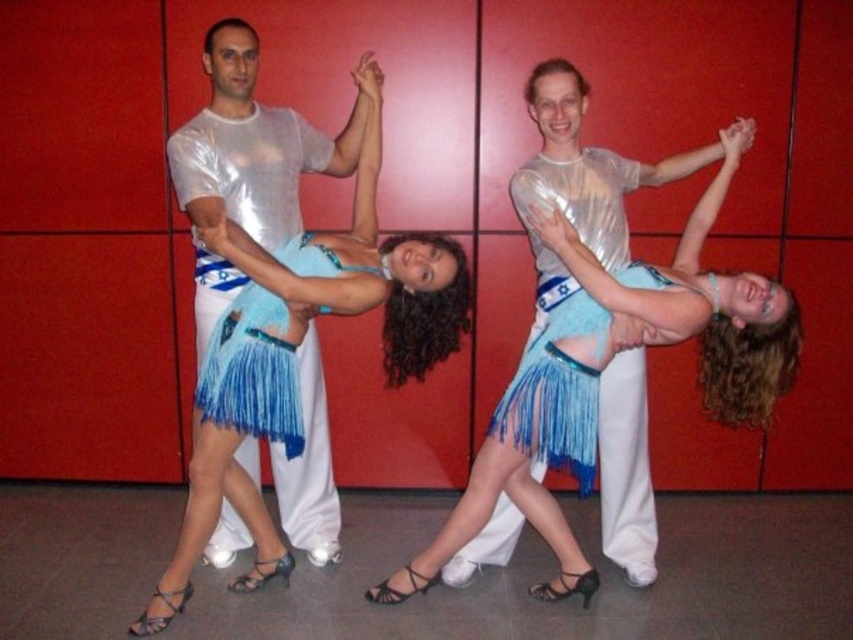
Is shiny metallic shirt at center bigger than fringed blue fabric skirt at center?

Yes, shiny metallic shirt at center is bigger than fringed blue fabric skirt at center.

Between point (230, 54) and point (199, 292), which one is positioned behind?

The point (199, 292) is more distant.

This screenshot has width=853, height=640. I want to click on shiny metallic shirt at center, so click(247, 168).

You are a GUI agent. You are given a task and a screenshot of the screen. Output one action in this format:
    pyautogui.click(x=<x>, y=<y>)
    Task: Click on the shiny metallic shirt at center
    
    Given the screenshot: What is the action you would take?
    pyautogui.click(x=247, y=168)

What do you see at coordinates (598, 376) in the screenshot? I see `shiny blue skirt at center` at bounding box center [598, 376].

Is shiny blue skirt at center bigger than fringed blue fabric skirt at center?

Yes, shiny blue skirt at center is bigger than fringed blue fabric skirt at center.

Locate an element on the screen. Image resolution: width=853 pixels, height=640 pixels. shiny blue skirt at center is located at coordinates (598, 376).

Which is below, shiny blue skirt at center or shiny metallic shirt at center?

Positioned lower is shiny blue skirt at center.

Between point (567, 333) and point (229, 113), which one is positioned in front?

Point (567, 333)

You are a GUI agent. You are given a task and a screenshot of the screen. Output one action in this format:
    pyautogui.click(x=<x>, y=<y>)
    Task: Click on the shiny blue skirt at center
    The image size is (853, 640).
    Given the screenshot: What is the action you would take?
    pyautogui.click(x=598, y=376)